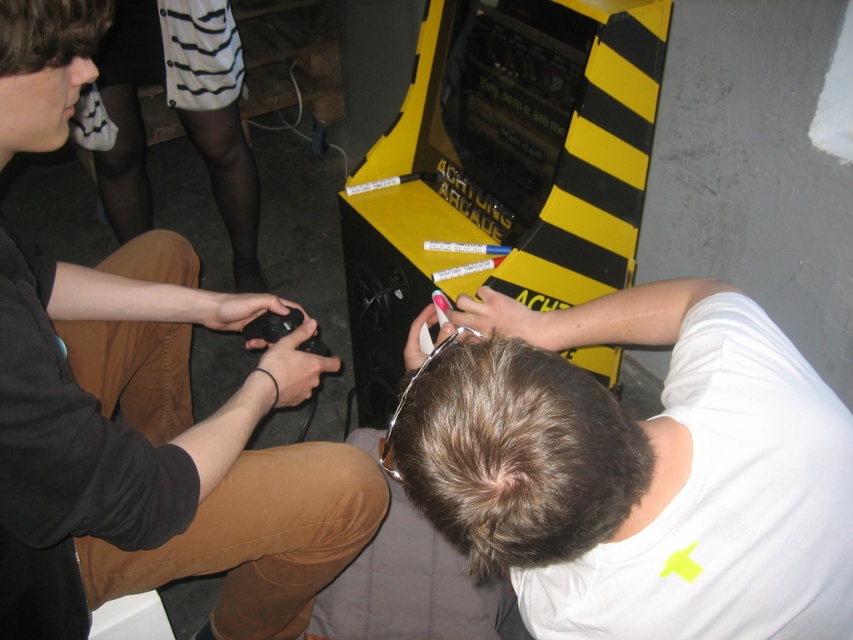
From the picture: You are standing in front of the arcade machine and want to reach both points. Which point, point (x=407, y=452) or point (x=84, y=52), is closer to you?

Point (x=407, y=452) is closer to the viewer than point (x=84, y=52).

You are a game developer analyzing the placement of the black matte controller at lower left and dark brown hair at center in the image. Which object occupies more horizontal space in the scene?

The black matte controller at lower left is wider than dark brown hair at center, so it occupies more horizontal space in the scene.

You are a game developer testing the placement of the black matte controller at lower left in relation to the camera. The recommended distance between the controller and camera should be at least 25 inches to ensure proper tracking. Is the current placement within the acceptable range?

The black matte controller at lower left and camera are 27.17 inches apart, which is within the recommended minimum distance of 25 inches. The current placement allows for proper tracking.